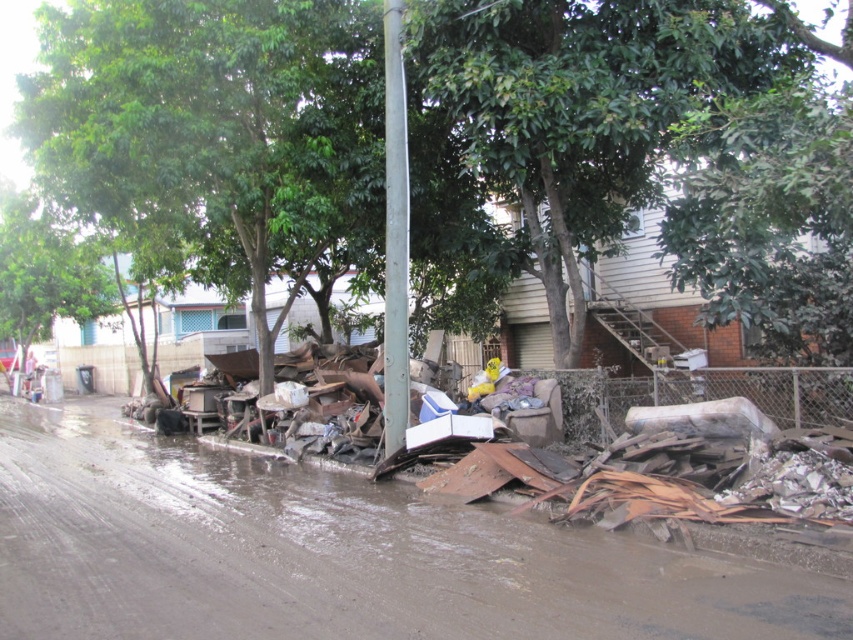
You are a city planner evaluating the safety of the area. You notice the rusty metal debris at lower right and the metallic gray pole at center. Which object is nearer to you as you stand at the scene?

The rusty metal debris at lower right is closer to the viewer than the metallic gray pole at center.

You are a city planner reviewing this area to assess cleanup priorities. You notice the rusty metal debris at lower right and the green leafy tree at center. Which object is closer to the left edge of the image?

The rusty metal debris at lower right is positioned on the left side of green leafy tree at center, so it is closer to the left edge of the image than the tree.

You are a city planner evaluating the cleanup of the area. You need to place a 4 meter long safety barrier between the rusty metal debris at lower right and the metallic gray pole at center. Is there enough space to place the barrier between them?

The distance between the rusty metal debris at lower right and the metallic gray pole at center is 3.84 meters, which is shorter than the 4 meter long barrier. Therefore, there isn not enough space to place the barrier between them.